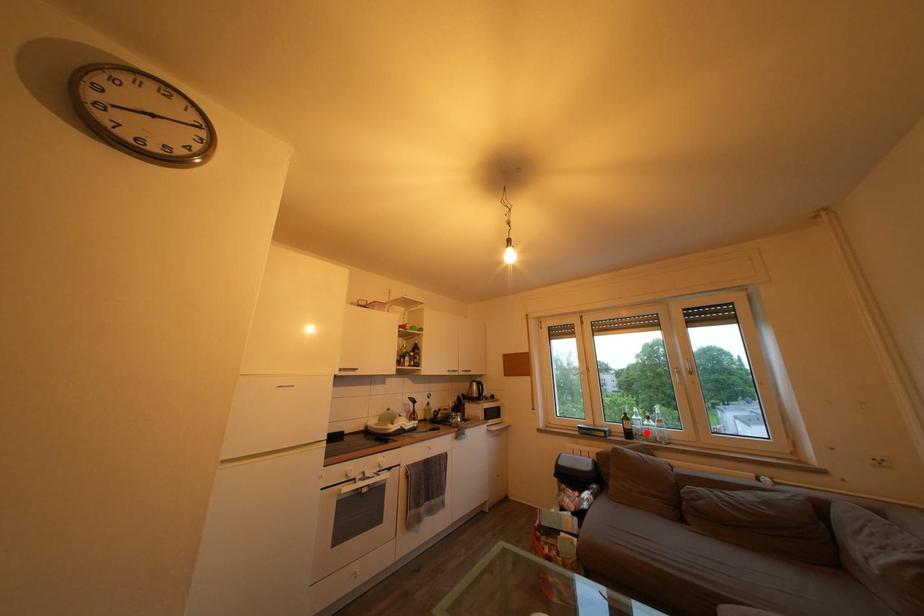
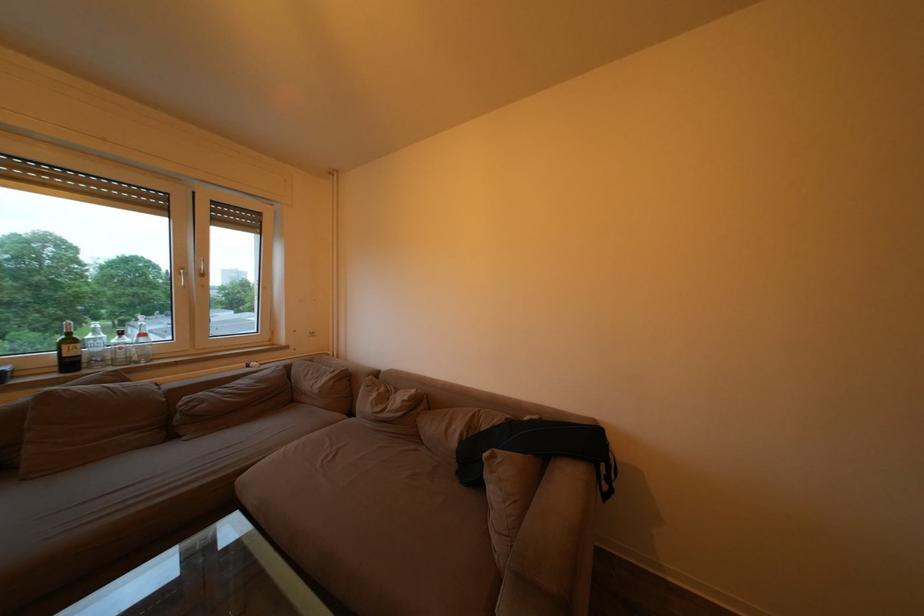
Question: A red point is marked in image1. In image2, is the corresponding 3D point closer to the camera or farther? Reply with the corresponding letter.

Choices:
 (A) The corresponding 3D point is closer.
 (B) The corresponding 3D point is farther.

Answer: (A)